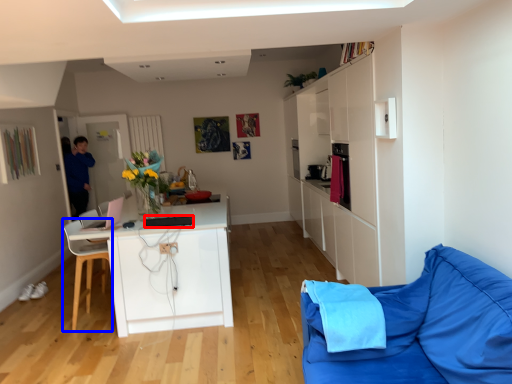
Question: Which of the following is the closest to the observer, appliance (highlighted by a red box) or chair (highlighted by a blue box)?

Choices:
 (A) appliance
 (B) chair

Answer: (A)